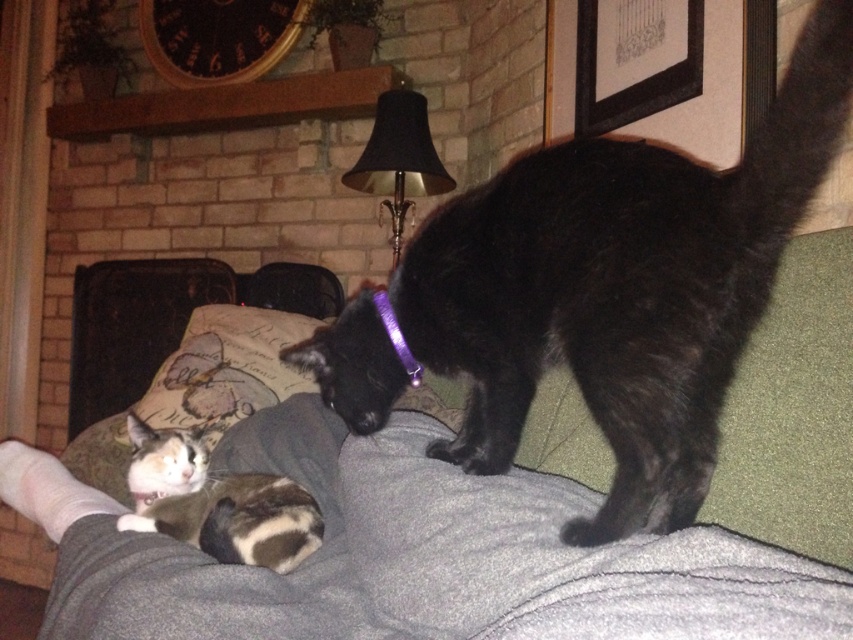
Between green fabric couch at upper center and calico fur cat at lower left, which one is positioned lower?

calico fur cat at lower left

Is green fabric couch at upper center positioned behind calico fur cat at lower left?

No, green fabric couch at upper center is closer to the viewer.

Is point (566, 394) less distant than point (239, 556)?

No.

This screenshot has height=640, width=853. Identify the location of green fabric couch at upper center. (415, 556).

Is green fabric couch at upper center thinner than purple plastic collar at upper center?

No, green fabric couch at upper center is not thinner than purple plastic collar at upper center.

Does green fabric couch at upper center appear under purple plastic collar at upper center?

Correct, green fabric couch at upper center is located below purple plastic collar at upper center.

Locate an element on the screen. This screenshot has width=853, height=640. green fabric couch at upper center is located at coordinates [415, 556].

This screenshot has height=640, width=853. I want to click on green fabric couch at upper center, so click(415, 556).

Can you confirm if calico fur cat at lower left is wider than purple plastic collar at upper center?

Indeed, calico fur cat at lower left has a greater width compared to purple plastic collar at upper center.

This screenshot has width=853, height=640. I want to click on calico fur cat at lower left, so click(x=216, y=502).

Identify the location of calico fur cat at lower left. The width and height of the screenshot is (853, 640). [x=216, y=502].

The width and height of the screenshot is (853, 640). I want to click on calico fur cat at lower left, so click(216, 502).